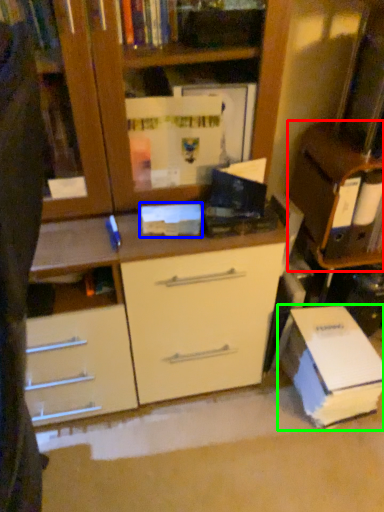
Question: Considering the real-world distances, which object is farthest from cabinetry (highlighted by a red box)? paperback book (highlighted by a blue box) or paperback book (highlighted by a green box)?

Choices:
 (A) paperback book
 (B) paperback book

Answer: (A)